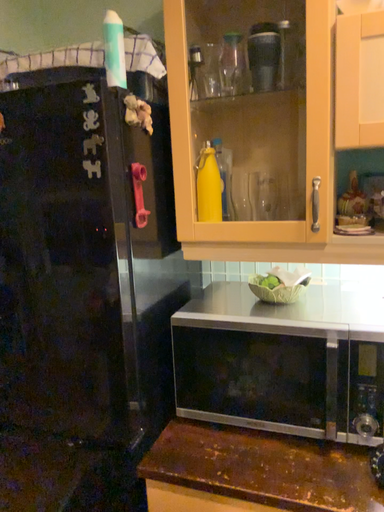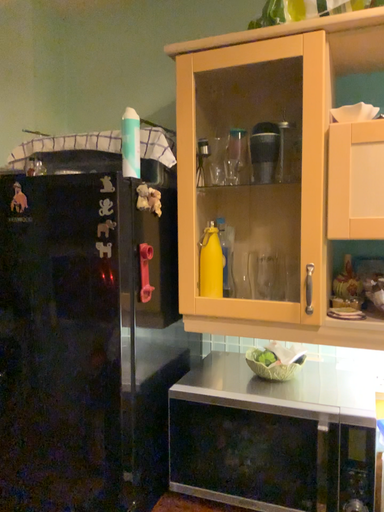
Question: Which way did the camera rotate in the video?

Choices:
 (A) rotated upward
 (B) rotated downward

Answer: (A)